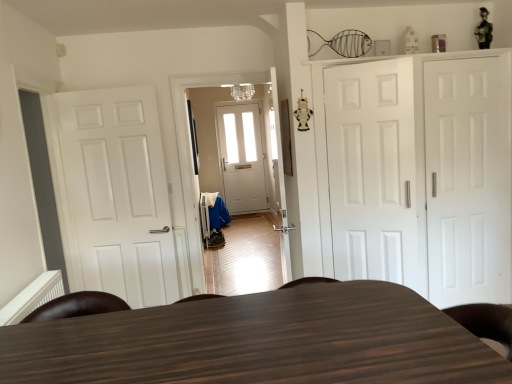
You are a GUI agent. You are given a task and a screenshot of the screen. Output one action in this format:
    pyautogui.click(x=<x>, y=<y>)
    Task: Click on the free spot above dark wood table at center (from a real-world perspective)
    
    Given the screenshot: What is the action you would take?
    pyautogui.click(x=282, y=334)